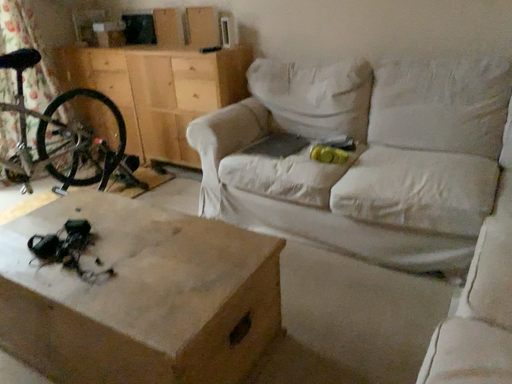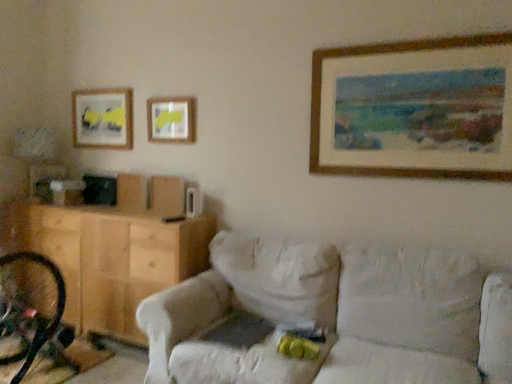
Question: Which way did the camera rotate in the video?

Choices:
 (A) rotated left
 (B) rotated right

Answer: (B)